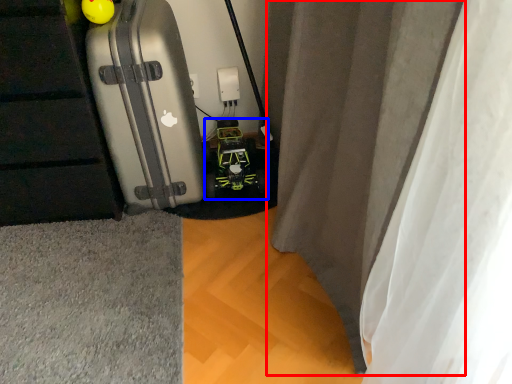
Question: Which of the following is the farthest to the observer, curtain (highlighted by a red box) or toy car (highlighted by a blue box)?

Choices:
 (A) curtain
 (B) toy car

Answer: (B)